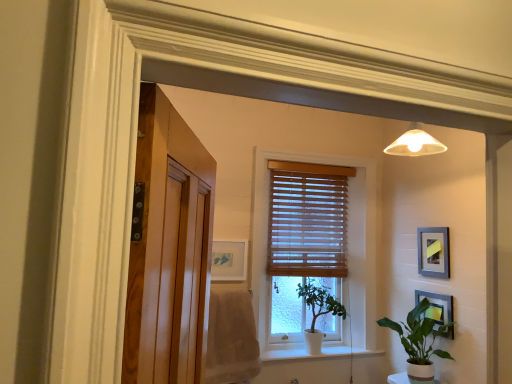
This screenshot has width=512, height=384. I want to click on gray matte picture frame at upper right, marked as the third picture frame in a left-to-right arrangement, so click(x=433, y=252).

You are a GUI agent. You are given a task and a screenshot of the screen. Output one action in this format:
    pyautogui.click(x=<x>, y=<y>)
    Task: Click on the wooden blinds at center
    This screenshot has height=384, width=512.
    Given the screenshot: What is the action you would take?
    pyautogui.click(x=307, y=219)

Measure the distance between wooden blinds at center and camera.

They are 2.97 meters apart.

What do you see at coordinates (347, 249) in the screenshot? I see `wooden blinds at center` at bounding box center [347, 249].

Find the location of `beige cotton bath towel at left`. beige cotton bath towel at left is located at coordinates tap(231, 337).

The width and height of the screenshot is (512, 384). I want to click on green matte plant at center, marked as the 1th houseplant in a back-to-front arrangement, so click(318, 312).

This screenshot has height=384, width=512. What do you see at coordinates (436, 306) in the screenshot?
I see `metallic silver picture frame at lower right, the second picture frame when ordered from right to left` at bounding box center [436, 306].

Image resolution: width=512 pixels, height=384 pixels. What are the coordinates of `gray matte picture frame at upper right, marked as the third picture frame in a left-to-right arrangement` in the screenshot? It's located at (433, 252).

Is green matte plant at center, the 2th houseplant in the right-to-left sequence, positioned before beige cotton bath towel at left?

No, it is not.

From the image's perspective, is green matte plant at center, marked as the 1th houseplant in a back-to-front arrangement, under beige cotton bath towel at left?

No, from the image's perspective, green matte plant at center, marked as the 1th houseplant in a back-to-front arrangement, is not below beige cotton bath towel at left.

Is green matte plant at center, marked as the 1th houseplant in a back-to-front arrangement, far away from beige cotton bath towel at left?

No, green matte plant at center, marked as the 1th houseplant in a back-to-front arrangement, is in close proximity to beige cotton bath towel at left.

Consider the image. How much distance is there between green matte plant at center, the 2th houseplant in the right-to-left sequence, and beige cotton bath towel at left?

23.66 inches.

Are matte white picture frame at center, which is counted as the 1th picture frame, starting from the left, and metallic silver picture frame at lower right, the 2th picture frame when ordered from left to right, far apart?

Indeed, matte white picture frame at center, which is counted as the 1th picture frame, starting from the left, is not near metallic silver picture frame at lower right, the 2th picture frame when ordered from left to right.

Is matte white picture frame at center, the third picture frame positioned from the right, inside or outside of metallic silver picture frame at lower right, the 2th picture frame when ordered from left to right?

matte white picture frame at center, the third picture frame positioned from the right, is spatially situated outside metallic silver picture frame at lower right, the 2th picture frame when ordered from left to right.

From a real-world perspective, which object stands above the other?

matte white picture frame at center, the third picture frame positioned from the right, is physically above.

Which is nearer, (279, 250) or (239, 357)?

Point (279, 250) appears to be farther away from the viewer than point (239, 357).

Is wooden blinds at center further to camera compared to beige cotton bath towel at left?

Yes, wooden blinds at center is behind beige cotton bath towel at left.

Looking at this image, from a real-world perspective, between wooden blinds at center and beige cotton bath towel at left, who is vertically higher?

In real-world perspective, wooden blinds at center is above.

Could you measure the distance between green matte plant at center, the 2th houseplant in the right-to-left sequence, and wooden blinds at center?

16.57 inches.

From a real-world perspective, which object rests below the other?

green matte plant at center, marked as the 1th houseplant in a back-to-front arrangement, is physically lower.

Are green matte plant at center, which is the 1th houseplant from left to right, and wooden blinds at center far apart?

No, green matte plant at center, which is the 1th houseplant from left to right, is not far from wooden blinds at center.

I want to click on the 1st houseplant in front of the wooden blinds at center, starting your count from the anchor, so click(318, 312).

From the image's perspective, between green glossy houseplant at lower right, the first houseplant viewed from the front, and green matte plant at center, marked as the 1th houseplant in a back-to-front arrangement, which one is located above?

green matte plant at center, marked as the 1th houseplant in a back-to-front arrangement, appears higher in the image.

From a real-world perspective, is green glossy houseplant at lower right, which is the second houseplant from left to right, beneath green matte plant at center, which is the 1th houseplant from left to right?

A: Yes, from a real-world perspective, green glossy houseplant at lower right, which is the second houseplant from left to right, is beneath green matte plant at center, which is the 1th houseplant from left to right.

Is green glossy houseplant at lower right, positioned as the second houseplant in back-to-front order, positioned beyond the bounds of green matte plant at center, the 2th houseplant in the right-to-left sequence?

Yes.

Is point (423, 326) in front of point (317, 290)?

Yes, it is in front of point (317, 290).

Which object is closer to the camera taking this photo, gray matte picture frame at upper right, which is the 1th picture frame in right-to-left order, or metallic silver picture frame at lower right, the second picture frame when ordered from right to left?

metallic silver picture frame at lower right, the second picture frame when ordered from right to left.

Is gray matte picture frame at upper right, marked as the third picture frame in a left-to-right arrangement, taller or shorter than metallic silver picture frame at lower right, the 2th picture frame when ordered from left to right?

In the image, gray matte picture frame at upper right, marked as the third picture frame in a left-to-right arrangement, appears to be taller than metallic silver picture frame at lower right, the 2th picture frame when ordered from left to right.

Is metallic silver picture frame at lower right, the 2th picture frame when ordered from left to right, at the back of gray matte picture frame at upper right, marked as the third picture frame in a left-to-right arrangement?

No, gray matte picture frame at upper right, marked as the third picture frame in a left-to-right arrangement, is not facing the opposite direction of metallic silver picture frame at lower right, the 2th picture frame when ordered from left to right.

Between beige cotton bath towel at left and green glossy houseplant at lower right, placed as the 1th houseplant when sorted from right to left, which one has larger width?

With larger width is green glossy houseplant at lower right, placed as the 1th houseplant when sorted from right to left.

Is beige cotton bath towel at left far from green glossy houseplant at lower right, the first houseplant viewed from the front?

Indeed, beige cotton bath towel at left is not near green glossy houseplant at lower right, the first houseplant viewed from the front.

Who is smaller, beige cotton bath towel at left or green glossy houseplant at lower right, which is the second houseplant from left to right?

With smaller size is beige cotton bath towel at left.

Would you say beige cotton bath towel at left is inside or outside green glossy houseplant at lower right, the first houseplant viewed from the front?

beige cotton bath towel at left lies outside green glossy houseplant at lower right, the first houseplant viewed from the front.

Identify the location of the 2nd houseplant located above the beige cotton bath towel at left (from a real-world perspective). The image size is (512, 384). (318, 312).

Starting from the matte white picture frame at center, the third picture frame positioned from the right, which picture frame is the 1st one to the right? Please provide its 2D coordinates.

[(436, 306)]

Looking at the image, which one is located further to wooden blinds at center, matte white picture frame at center, which is counted as the 1th picture frame, starting from the left, or green glossy houseplant at lower right, placed as the 1th houseplant when sorted from right to left?

green glossy houseplant at lower right, placed as the 1th houseplant when sorted from right to left, lies further to wooden blinds at center than the other object.

Considering their positions, is gray matte picture frame at upper right, which is the 1th picture frame in right-to-left order, positioned closer to green matte plant at center, marked as the 1th houseplant in a back-to-front arrangement, than wooden blinds at center?

Among the two, wooden blinds at center is located nearer to green matte plant at center, marked as the 1th houseplant in a back-to-front arrangement.

Based on their spatial positions, is wooden blinds at center or matte white picture frame at center, the third picture frame positioned from the right, closer to wooden blinds at center?

wooden blinds at center lies closer to wooden blinds at center than the other object.

Consider the image. Which object lies nearer to the anchor point green glossy houseplant at lower right, which is the second houseplant from left to right, wooden blinds at center or beige cotton bath towel at left?

wooden blinds at center.

When comparing their distances from wooden blinds at center, does green glossy houseplant at lower right, positioned as the second houseplant in back-to-front order, or beige cotton bath towel at left seem further?

green glossy houseplant at lower right, positioned as the second houseplant in back-to-front order, is positioned further to the anchor wooden blinds at center.

Estimate the real-world distances between objects in this image. Which object is further from metallic silver picture frame at lower right, the second picture frame when ordered from right to left, gray matte picture frame at upper right, which is the 1th picture frame in right-to-left order, or matte white picture frame at center, the third picture frame positioned from the right?

matte white picture frame at center, the third picture frame positioned from the right, lies further to metallic silver picture frame at lower right, the second picture frame when ordered from right to left, than the other object.

Looking at this image, estimate the real-world distances between objects in this image. Which object is closer to green glossy houseplant at lower right, the first houseplant viewed from the front, metallic silver picture frame at lower right, the second picture frame when ordered from right to left, or wooden blinds at center?

metallic silver picture frame at lower right, the second picture frame when ordered from right to left.

Looking at the image, which one is located closer to wooden blinds at center, metallic silver picture frame at lower right, the 2th picture frame when ordered from left to right, or wooden blinds at center?

wooden blinds at center is positioned closer to the anchor wooden blinds at center.

Locate an element on the screen. The width and height of the screenshot is (512, 384). window between matte white picture frame at center, the third picture frame positioned from the right, and wooden blinds at center, in the horizontal direction is located at coordinates (347, 249).

This screenshot has height=384, width=512. I want to click on window between beige cotton bath towel at left and green matte plant at center, positioned as the second houseplant in front-to-back order, from left to right, so click(x=347, y=249).

You are a GUI agent. You are given a task and a screenshot of the screen. Output one action in this format:
    pyautogui.click(x=<x>, y=<y>)
    Task: Click on the bath towel situated between matte white picture frame at center, the third picture frame positioned from the right, and green matte plant at center, the 2th houseplant in the right-to-left sequence, from left to right
    
    Given the screenshot: What is the action you would take?
    pyautogui.click(x=231, y=337)

You are a GUI agent. You are given a task and a screenshot of the screen. Output one action in this format:
    pyautogui.click(x=<x>, y=<y>)
    Task: Click on the window blind between matte white picture frame at center, which is counted as the 1th picture frame, starting from the left, and green glossy houseplant at lower right, placed as the 1th houseplant when sorted from right to left
    Image resolution: width=512 pixels, height=384 pixels.
    Given the screenshot: What is the action you would take?
    pyautogui.click(x=307, y=219)